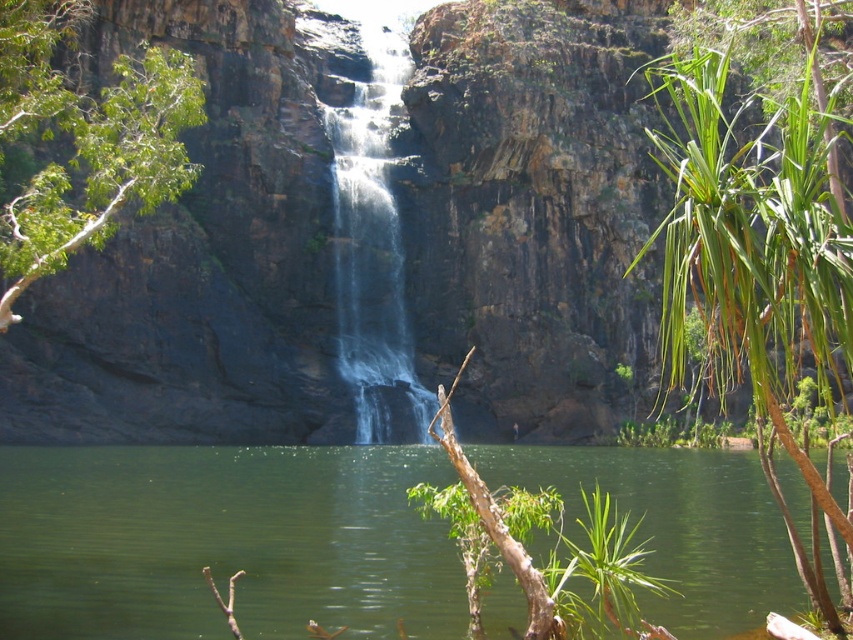
You are standing at the edge of the waterfall and see both the green liquid water at center and the clear water at center. Which one is located below the other?

The green liquid water at center is positioned under the clear water at center.

You are a hiker who wants to cross the waterfall area. You see the green liquid water at center and the clear water at center. Which one is a safer path to walk on?

The clear water at center is a safer path to walk on because it occupies more space than the green liquid water at center, indicating it might be deeper and more stable.

You are standing at the edge of the cliff overlooking the green liquid water at center. If you want to throw a pebble to hit the water as close as possible to the point marked at coordinates 0.847, 0.263, where should you aim relative to the waterfall?

The green liquid water at center is located at point [223,541], so you should aim directly at that point to hit the water closest to the specified coordinates.